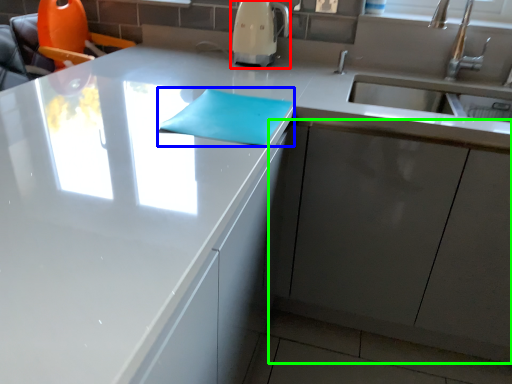
Question: Considering the real-world distances, which object is closest to coffee machine (highlighted by a red box)? notepad (highlighted by a blue box) or cabinetry (highlighted by a green box).

Choices:
 (A) notepad
 (B) cabinetry

Answer: (A)